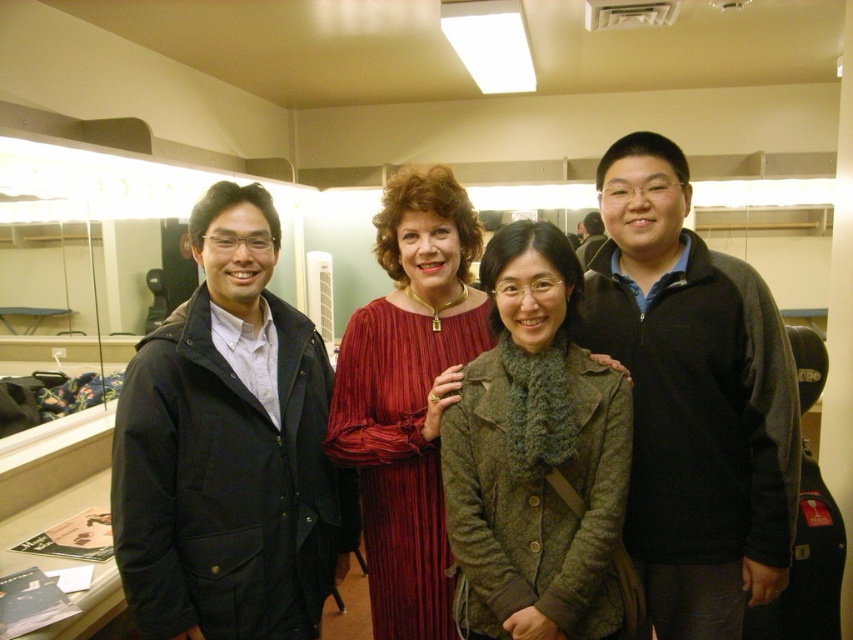
You are standing in the backstage area and want to take a photo of the point at coordinates (698, 465). The camera you are using has a minimum focus distance of 1.5 meters. Can the camera focus on the point?

The point at coordinates (698, 465) is 1.57 meters from the camera. Since the minimum focus distance is 1.5 meters, the camera can focus on the point as it is within the required range.

You are standing in the backstage area and notice two points marked on the wall. The first point is at coordinates point (323, 374) and the second is at point (637, 170). Which point is closer to you?

Point (323, 374) is closer to you because it is further to the viewer than point (637, 170).

In the image, there is a point at coordinates (692, 397). Which object from the list is this point located on?

The point at coordinates (692, 397) is located on the matte black coat at left.